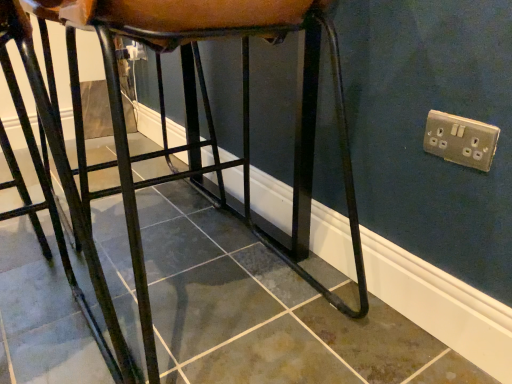
Question: From a real-world perspective, is silver metallic socket at upper right below matte black stool at center?

Choices:
 (A) yes
 (B) no

Answer: (B)

Question: Is silver metallic socket at upper right oriented away from matte black stool at center?

Choices:
 (A) yes
 (B) no

Answer: (B)

Question: Can you confirm if silver metallic socket at upper right is smaller than matte black stool at center?

Choices:
 (A) no
 (B) yes

Answer: (B)

Question: Is there a large distance between silver metallic socket at upper right and matte black stool at center?

Choices:
 (A) yes
 (B) no

Answer: (B)

Question: Could you tell me if silver metallic socket at upper right is turned towards matte black stool at center?

Choices:
 (A) yes
 (B) no

Answer: (B)

Question: Can you confirm if silver metallic socket at upper right is taller than matte black stool at center?

Choices:
 (A) yes
 (B) no

Answer: (B)

Question: Is matte black stool at center positioned beyond the bounds of silver metallic socket at upper right?

Choices:
 (A) no
 (B) yes

Answer: (B)

Question: Is matte black stool at center smaller than silver metallic socket at upper right?

Choices:
 (A) yes
 (B) no

Answer: (B)

Question: From a real-world perspective, is matte black stool at center positioned over silver metallic socket at upper right based on gravity?

Choices:
 (A) yes
 (B) no

Answer: (B)

Question: Does matte black stool at center touch silver metallic socket at upper right?

Choices:
 (A) no
 (B) yes

Answer: (A)

Question: Is matte black stool at center closer to the viewer compared to silver metallic socket at upper right?

Choices:
 (A) yes
 (B) no

Answer: (A)

Question: Is matte black stool at center bigger than silver metallic socket at upper right?

Choices:
 (A) no
 (B) yes

Answer: (B)

Question: Considering their positions, is matte black stool at center located in front of or behind silver metallic socket at upper right?

Choices:
 (A) behind
 (B) front

Answer: (B)